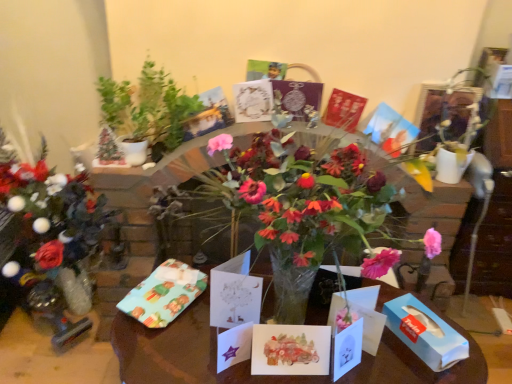
Where is `vacant region to the left of blue paper tissue box at lower right`? This screenshot has width=512, height=384. vacant region to the left of blue paper tissue box at lower right is located at coordinates (381, 355).